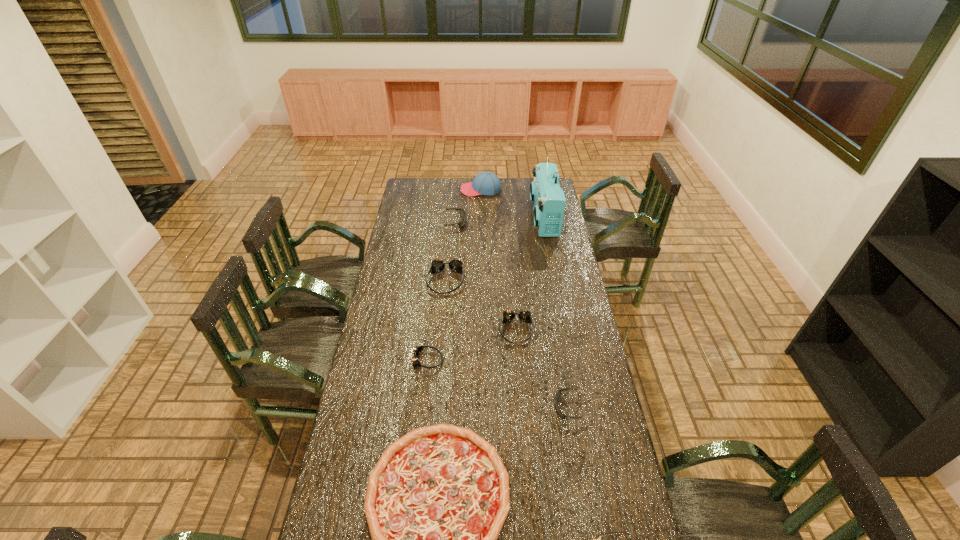
The width and height of the screenshot is (960, 540). I want to click on vacant space located through the lenses of the sixth nearest object, so click(441, 337).

Image resolution: width=960 pixels, height=540 pixels. In order to click on vacant space located through the lenses of the second biggest bronze goggles in this screenshot , I will do `click(520, 388)`.

The height and width of the screenshot is (540, 960). Find the location of `free spot located 0.400m on the lenses of the left black goggles`. free spot located 0.400m on the lenses of the left black goggles is located at coordinates (540, 222).

Find the location of a particular element. The width and height of the screenshot is (960, 540). vacant region located through the lenses of the smallest bronze goggles is located at coordinates (545, 360).

Where is `vacant position located on the lenses of the smaller black goggles`? vacant position located on the lenses of the smaller black goggles is located at coordinates (500, 407).

This screenshot has width=960, height=540. I want to click on free space located on the lenses of the smaller black goggles, so click(x=500, y=407).

Identify the location of vacant space located 0.100m on the lenses of the smaller black goggles. The width and height of the screenshot is (960, 540). (526, 407).

Locate an element on the screen. The height and width of the screenshot is (540, 960). radio receiver located in the far edge section of the desktop is located at coordinates (548, 198).

Locate an element on the screen. baseball cap located in the far edge section of the desktop is located at coordinates (487, 183).

Identify the location of radio receiver that is at the right edge. (548, 198).